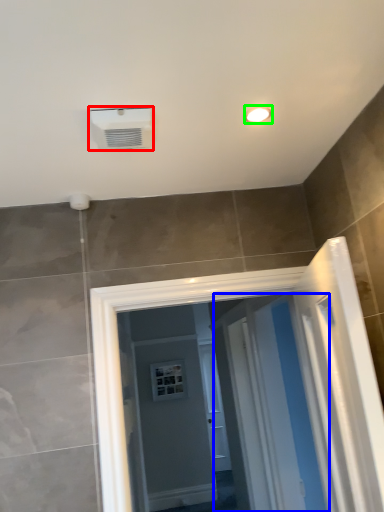
Question: Which object is the farthest from air conditioning (highlighted by a red box)? Choose among these: screen door (highlighted by a blue box) or light fixture (highlighted by a green box).

Choices:
 (A) screen door
 (B) light fixture

Answer: (A)